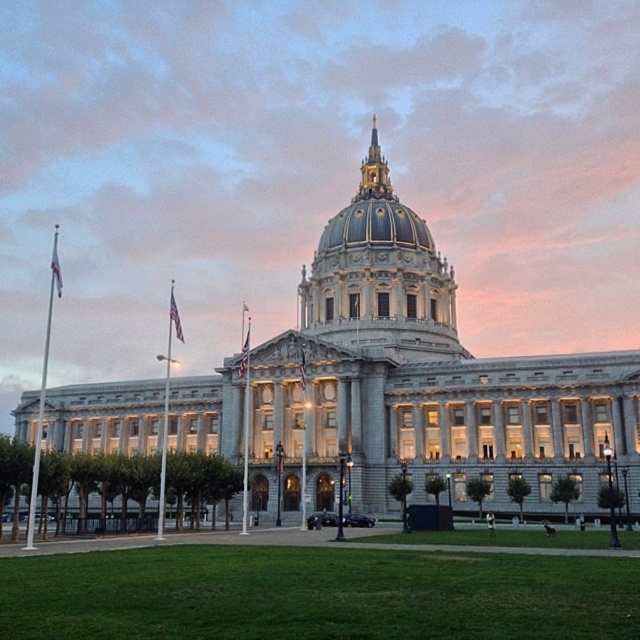
Question: Which object appears closest to the camera in this image?

Choices:
 (A) gray stone building at center
 (B) gold/gilded dome at center
 (C) green grass at lower center
 (D) blue/golden dome at center

Answer: (C)

Question: Is gold/gilded dome at center wider than blue/golden dome at center?

Choices:
 (A) yes
 (B) no

Answer: (A)

Question: Which point appears farthest from the camera in this image?

Choices:
 (A) (419, 326)
 (B) (349, 227)

Answer: (B)

Question: Which point is closer to the camera taking this photo?

Choices:
 (A) (467, 577)
 (B) (301, 438)
 (C) (342, 218)
 (D) (433, 266)

Answer: (A)

Question: In this image, where is green grass at lower center located relative to gold/gilded dome at center?

Choices:
 (A) above
 (B) below

Answer: (B)

Question: Can you confirm if gray stone building at center is bigger than gold/gilded dome at center?

Choices:
 (A) yes
 (B) no

Answer: (A)